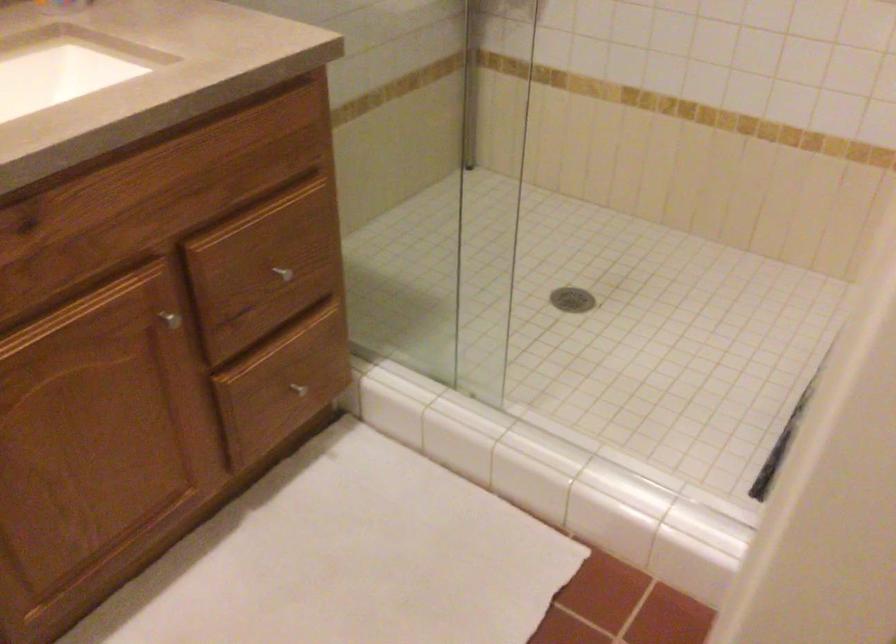
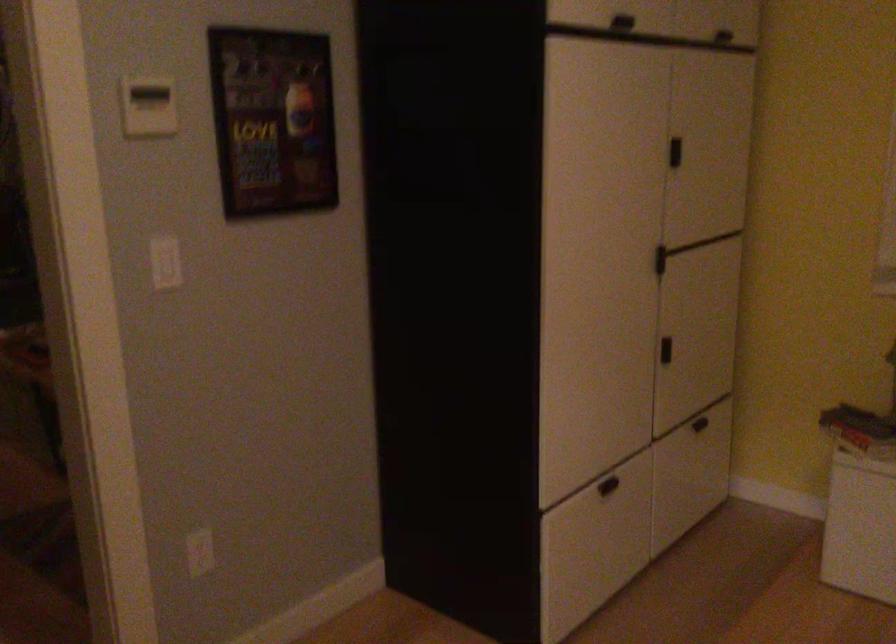
Question: The camera is either moving clockwise (left) or counter-clockwise (right) around the object. The first image is from the beginning of the video and the second image is from the end. Is the camera moving left or right when shooting the video?

Choices:
 (A) Left
 (B) Right

Answer: (A)